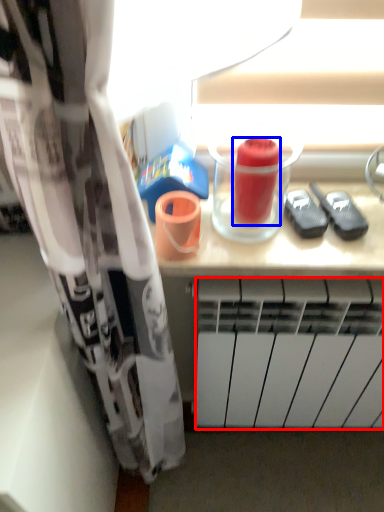
Question: Which object is closer to the camera taking this photo, radiator (highlighted by a red box) or beverage (highlighted by a blue box)?

Choices:
 (A) radiator
 (B) beverage

Answer: (B)